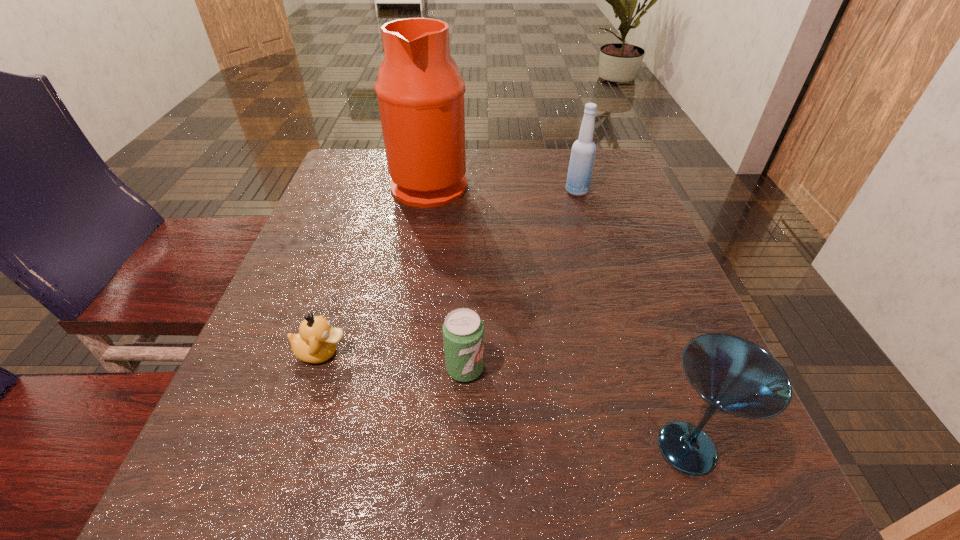
At what (x,y) coordinates should I click in order to perform the action: click on free area in between the shortest object and the tallest object. Please return your answer as a coordinate pair (x, y). This screenshot has height=540, width=960. Looking at the image, I should click on (375, 268).

At what (x,y) coordinates should I click in order to perform the action: click on free space between the fourth shortest object and the tallest object. Please return your answer as a coordinate pair (x, y). Looking at the image, I should click on (503, 187).

In order to click on vacant area that lies between the soda and the water jug in this screenshot , I will do `click(447, 276)`.

Locate an element on the screen. Image resolution: width=960 pixels, height=540 pixels. empty space that is in between the water jug and the duckling is located at coordinates (375, 268).

The image size is (960, 540). Identify the location of empty space that is in between the soda and the tallest object. (447, 276).

In order to click on free area in between the tallest object and the second tallest object in this screenshot , I will do `click(503, 187)`.

Identify the location of vacant area between the martini and the bottle. Image resolution: width=960 pixels, height=540 pixels. (632, 320).

The width and height of the screenshot is (960, 540). Find the location of `the third closest object to the shortest object`. the third closest object to the shortest object is located at coordinates (734, 376).

Point out which object is positioned as the fourth nearest to the fourth tallest object. Please provide its 2D coordinates. Your answer should be formatted as a tuple, i.e. [(x, y)], where the tuple contains the x and y coordinates of a point satisfying the conditions above.

[(583, 151)]

You are a GUI agent. You are given a task and a screenshot of the screen. Output one action in this format:
    pyautogui.click(x=<x>, y=<y>)
    Task: Click on the free point that satisfies the following two spatial constraints: 1. on the face of the third shortest object; 2. on the left side of the duckling
    This screenshot has height=540, width=960.
    Given the screenshot: What is the action you would take?
    pyautogui.click(x=291, y=448)